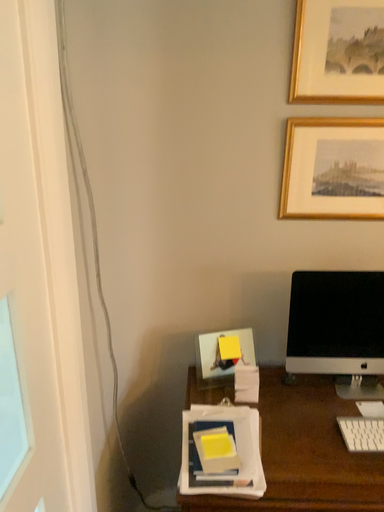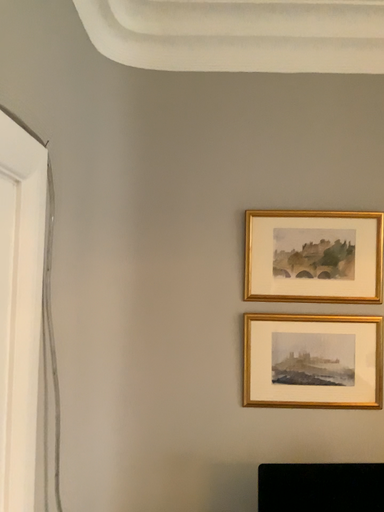
Question: Which way did the camera rotate in the video?

Choices:
 (A) rotated upward
 (B) rotated downward

Answer: (A)